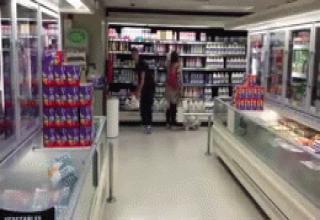
Where is `stands`? stands is located at coordinates (111, 162), (208, 130).